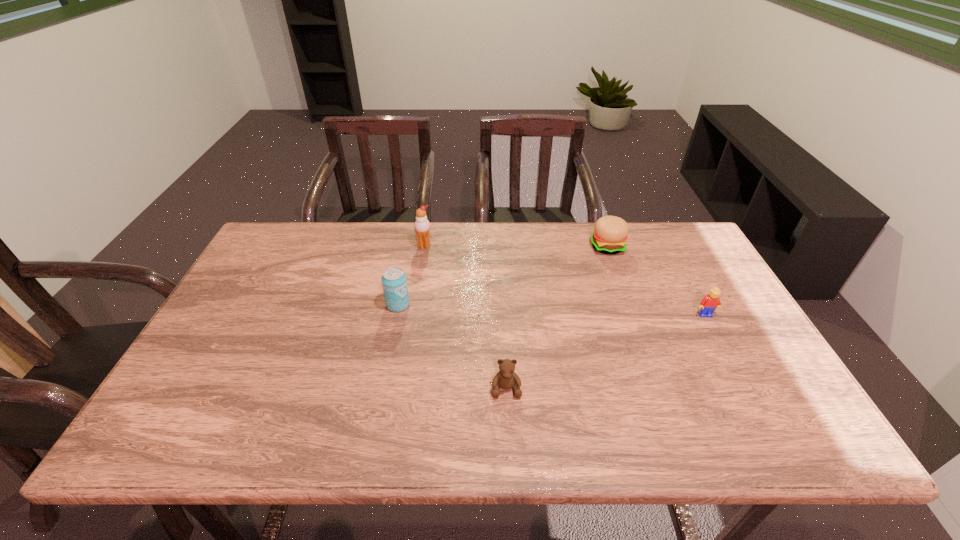
Identify the location of object that stands as the closest to the rightmost object. This screenshot has height=540, width=960. (610, 233).

This screenshot has height=540, width=960. Find the location of `free point that satisfies the following two spatial constraints: 1. at the front with a straw on the fourth object from left to right; 2. on the left side of the tallest object`. free point that satisfies the following two spatial constraints: 1. at the front with a straw on the fourth object from left to right; 2. on the left side of the tallest object is located at coordinates (424, 246).